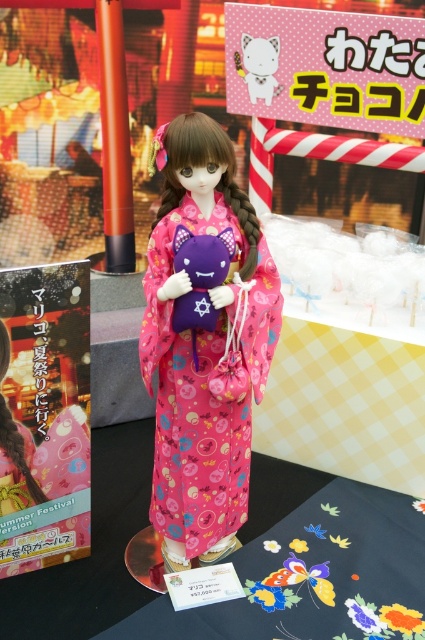
Question: Can you confirm if pink satin kimono at center is positioned below white matte plush cat at center?

Choices:
 (A) no
 (B) yes

Answer: (B)

Question: Is pink satin kimono at center to the right of white matte plush cat at center from the viewer's perspective?

Choices:
 (A) no
 (B) yes

Answer: (A)

Question: Among these objects, which one is nearest to the camera?

Choices:
 (A) white matte plush cat at center
 (B) pink satin kimono at center

Answer: (B)

Question: Which point appears closest to the camera in this image?

Choices:
 (A) (277, 51)
 (B) (215, 300)

Answer: (B)

Question: Is pink satin kimono at center behind white matte plush cat at center?

Choices:
 (A) no
 (B) yes

Answer: (A)

Question: Which point is farther from the camera taking this photo?

Choices:
 (A) (258, 81)
 (B) (175, 268)

Answer: (A)